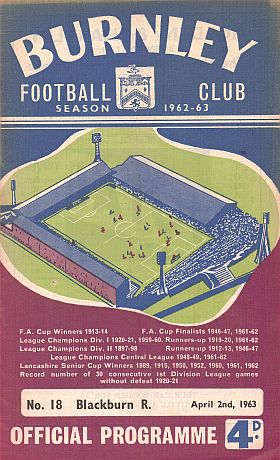
This screenshot has height=460, width=280. Find the location of `speaker`. speaker is located at coordinates (161, 256), (266, 218), (96, 137), (13, 186).